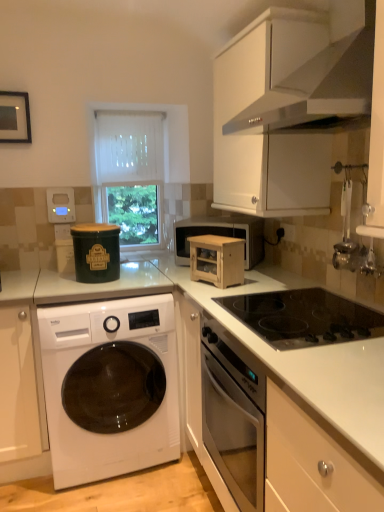
Question: Is white matte cabinet at upper right, placed as the first cabinetry when sorted from right to left, not within green matte container at upper left, acting as the second appliance starting from the back?

Choices:
 (A) no
 (B) yes

Answer: (B)

Question: From a real-world perspective, is white matte cabinet at upper right, placed as the first cabinetry when sorted from right to left, physically below green matte container at upper left, the second appliance in the front-to-back sequence?

Choices:
 (A) no
 (B) yes

Answer: (A)

Question: Can you confirm if white matte cabinet at upper right, which ranks as the 1th cabinetry in top-to-bottom order, is smaller than green matte container at upper left, acting as the second appliance starting from the back?

Choices:
 (A) no
 (B) yes

Answer: (A)

Question: Can you confirm if white matte cabinet at upper right, which appears as the second cabinetry when viewed from the left, is positioned to the right of green matte container at upper left, the second appliance in the front-to-back sequence?

Choices:
 (A) yes
 (B) no

Answer: (A)

Question: Can you confirm if white matte cabinet at upper right, placed as the first cabinetry when sorted from right to left, is wider than green matte container at upper left, which is the second appliance in right-to-left order?

Choices:
 (A) no
 (B) yes

Answer: (B)

Question: Does white matte cabinet at upper right, placed as the first cabinetry when sorted from right to left, lie behind green matte container at upper left, the second appliance in the front-to-back sequence?

Choices:
 (A) no
 (B) yes

Answer: (A)

Question: Considering the relative positions of wooden cabinet at center, the third appliance when ordered from back to front, and white matte exhaust hood at upper right in the image provided, is wooden cabinet at center, the third appliance when ordered from back to front, in front of white matte exhaust hood at upper right?

Choices:
 (A) no
 (B) yes

Answer: (A)

Question: Is wooden cabinet at center, the third appliance when ordered from back to front, at the right side of white matte exhaust hood at upper right?

Choices:
 (A) no
 (B) yes

Answer: (A)

Question: Is the depth of wooden cabinet at center, which is the 1th appliance from right to left, greater than that of white matte exhaust hood at upper right?

Choices:
 (A) yes
 (B) no

Answer: (A)

Question: Can white matte exhaust hood at upper right be found inside wooden cabinet at center, the third appliance when ordered from back to front?

Choices:
 (A) yes
 (B) no

Answer: (B)

Question: From a real-world perspective, is wooden cabinet at center, the third appliance when ordered from back to front, beneath white matte exhaust hood at upper right?

Choices:
 (A) yes
 (B) no

Answer: (A)

Question: Does wooden cabinet at center, marked as the 3th appliance in a left-to-right arrangement, have a greater height compared to white matte exhaust hood at upper right?

Choices:
 (A) no
 (B) yes

Answer: (A)

Question: Is white glossy washing machine at lower left located outside white sheer curtain at center?

Choices:
 (A) yes
 (B) no

Answer: (A)